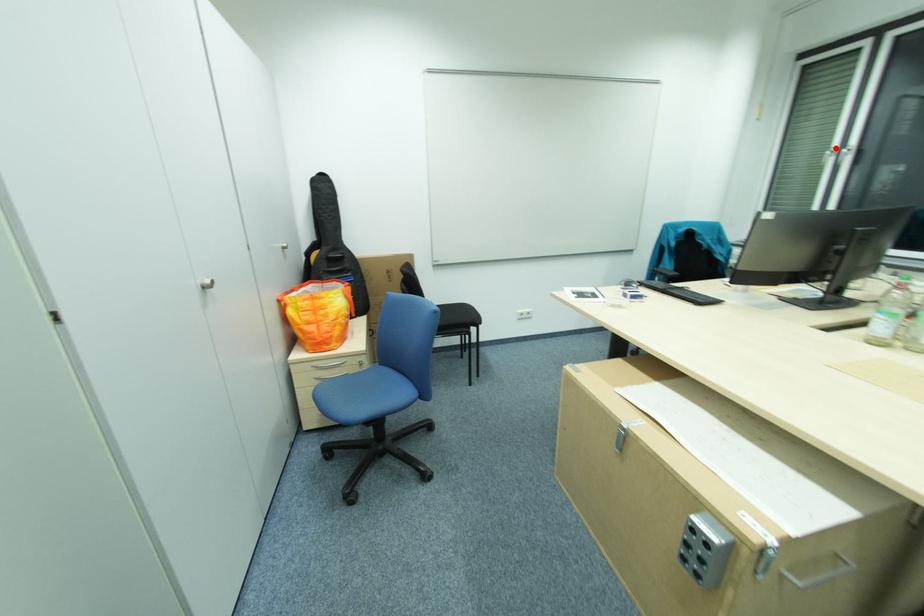
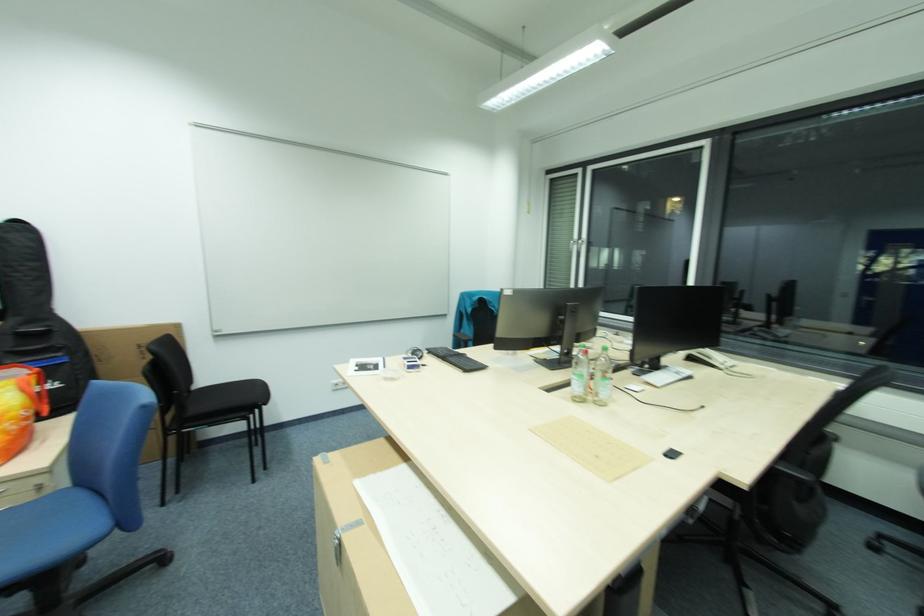
The point at the highlighted location is marked in the first image. Where is the corresponding point in the second image?

(580, 238)